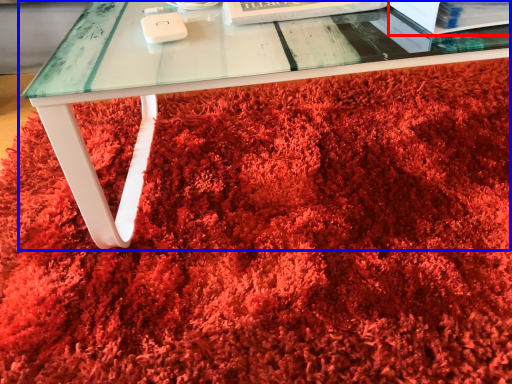
Question: Which point is further to the camera, paperback book (highlighted by a red box) or table (highlighted by a blue box)?

Choices:
 (A) paperback book
 (B) table

Answer: (A)